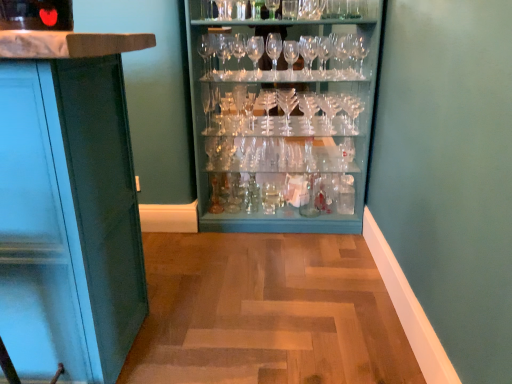
Question: Should I look upward or downward to see matte teal cabinet at left?

Choices:
 (A) up
 (B) down

Answer: (B)

Question: Is matte teal cabinet at left to the right of clear glassware at center from the viewer's perspective?

Choices:
 (A) yes
 (B) no

Answer: (B)

Question: From the image's perspective, is matte teal cabinet at left located above clear glassware at center?

Choices:
 (A) yes
 (B) no

Answer: (B)

Question: Does matte teal cabinet at left appear on the left side of clear glassware at center?

Choices:
 (A) no
 (B) yes

Answer: (B)

Question: Is matte teal cabinet at left oriented away from clear glassware at center?

Choices:
 (A) yes
 (B) no

Answer: (B)

Question: Considering the relative sizes of matte teal cabinet at left and clear glassware at center in the image provided, is matte teal cabinet at left bigger than clear glassware at center?

Choices:
 (A) yes
 (B) no

Answer: (B)

Question: From a real-world perspective, is matte teal cabinet at left located higher than clear glassware at center?

Choices:
 (A) no
 (B) yes

Answer: (A)

Question: From a real-world perspective, is clear glassware at center physically above matte teal cabinet at left?

Choices:
 (A) no
 (B) yes

Answer: (B)

Question: From a real-world perspective, is clear glassware at center located beneath matte teal cabinet at left?

Choices:
 (A) no
 (B) yes

Answer: (A)

Question: Can you confirm if clear glassware at center is positioned to the right of matte teal cabinet at left?

Choices:
 (A) yes
 (B) no

Answer: (A)

Question: Is matte teal cabinet at left at the back of clear glassware at center?

Choices:
 (A) yes
 (B) no

Answer: (B)

Question: Can you confirm if clear glassware at center is taller than matte teal cabinet at left?

Choices:
 (A) yes
 (B) no

Answer: (A)

Question: Considering the relative sizes of clear glassware at center and matte teal cabinet at left in the image provided, is clear glassware at center smaller than matte teal cabinet at left?

Choices:
 (A) yes
 (B) no

Answer: (B)

Question: Considering the positions of matte teal cabinet at left and clear glassware at center in the image, is matte teal cabinet at left wider or thinner than clear glassware at center?

Choices:
 (A) wide
 (B) thin

Answer: (A)